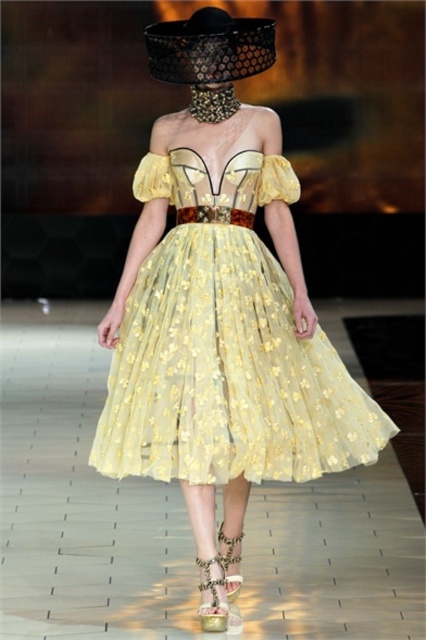
Question: Which of the following is the closest to the observer?

Choices:
 (A) [x=271, y=118]
 (B) [x=227, y=550]
 (C) [x=178, y=33]
 (D) [x=210, y=604]

Answer: (D)

Question: Which point is farther from the camera taking this photo?

Choices:
 (A) (222, 552)
 (B) (201, 582)

Answer: (A)

Question: Among these objects, which one is nearest to the camera?

Choices:
 (A) matte yellow fabric at upper center
 (B) yellow tulle dress at center
 (C) leopard print fabric sandal at lower center

Answer: (B)

Question: Can you confirm if yellow tulle dress at center is positioned to the right of gold metallic sandal at lower center?

Choices:
 (A) no
 (B) yes

Answer: (A)

Question: In this image, where is black woven hat at upper center located relative to matte yellow fabric at upper center?

Choices:
 (A) left
 (B) right

Answer: (A)

Question: Does matte yellow fabric at upper center have a smaller size compared to leopard print fabric sandal at lower center?

Choices:
 (A) yes
 (B) no

Answer: (A)